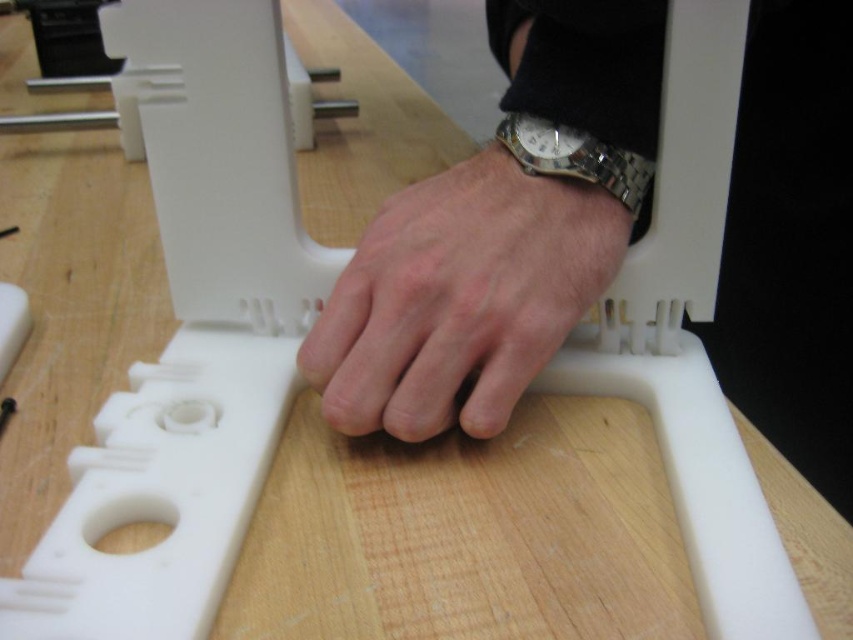
Question: Is skinny silver watch at center wider than gold-toned metallic watch at center?

Choices:
 (A) yes
 (B) no

Answer: (A)

Question: Does skinny silver watch at center appear over gold-toned metallic watch at center?

Choices:
 (A) no
 (B) yes

Answer: (A)

Question: Among these points, which one is nearest to the camera?

Choices:
 (A) (511, 132)
 (B) (463, 406)

Answer: (B)

Question: Is skinny silver watch at center below gold-toned metallic watch at center?

Choices:
 (A) no
 (B) yes

Answer: (B)

Question: Which point is closer to the camera?

Choices:
 (A) gold-toned metallic watch at center
 (B) skinny silver watch at center

Answer: (B)